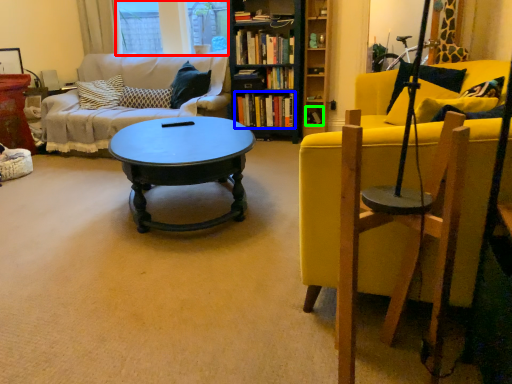
Question: Which is farther away from window screen (highlighted by a red box)? book (highlighted by a blue box) or book (highlighted by a green box)?

Choices:
 (A) book
 (B) book

Answer: (B)